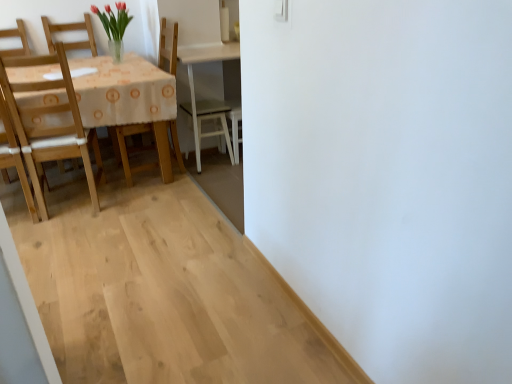
Question: From their relative heights in the image, would you say light wood chair at left, placed as the 1th chair when sorted from left to right, is taller or shorter than wooden chair at left, placed as the first chair when sorted from right to left?

Choices:
 (A) short
 (B) tall

Answer: (A)

Question: From the image's perspective, relative to wooden chair at left, placed as the first chair when sorted from right to left, is light wood chair at left, which ranks as the 2th chair in right-to-left order, above or below?

Choices:
 (A) above
 (B) below

Answer: (B)

Question: In the image, is light wood chair at left, which ranks as the 2th chair in right-to-left order, positioned in front of or behind wooden chair at left, placed as the first chair when sorted from right to left?

Choices:
 (A) front
 (B) behind

Answer: (A)

Question: Considering the positions of wooden chair at left, placed as the first chair when sorted from right to left, and light wood chair at left, placed as the 1th chair when sorted from left to right, in the image, is wooden chair at left, placed as the first chair when sorted from right to left, taller or shorter than light wood chair at left, placed as the 1th chair when sorted from left to right,?

Choices:
 (A) short
 (B) tall

Answer: (B)

Question: In terms of size, does wooden chair at left, placed as the first chair when sorted from right to left, appear bigger or smaller than light wood chair at left, placed as the 1th chair when sorted from left to right?

Choices:
 (A) big
 (B) small

Answer: (A)

Question: From the image's perspective, relative to light wood chair at left, which ranks as the 2th chair in right-to-left order, is wooden chair at left, the 2th chair from the left, above or below?

Choices:
 (A) below
 (B) above

Answer: (B)

Question: In terms of width, does wooden chair at left, placed as the first chair when sorted from right to left, look wider or thinner when compared to light wood chair at left, placed as the 1th chair when sorted from left to right?

Choices:
 (A) wide
 (B) thin

Answer: (B)